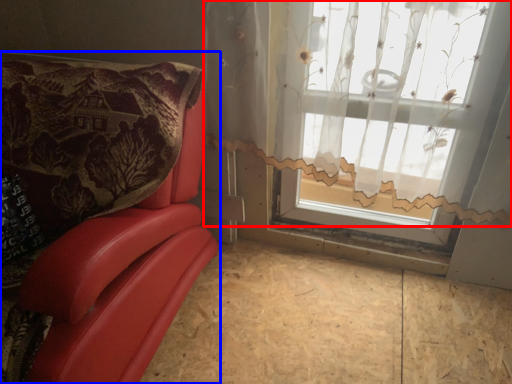
Question: Which of the following is the farthest to the observer, curtain (highlighted by a red box) or furniture (highlighted by a blue box)?

Choices:
 (A) curtain
 (B) furniture

Answer: (A)